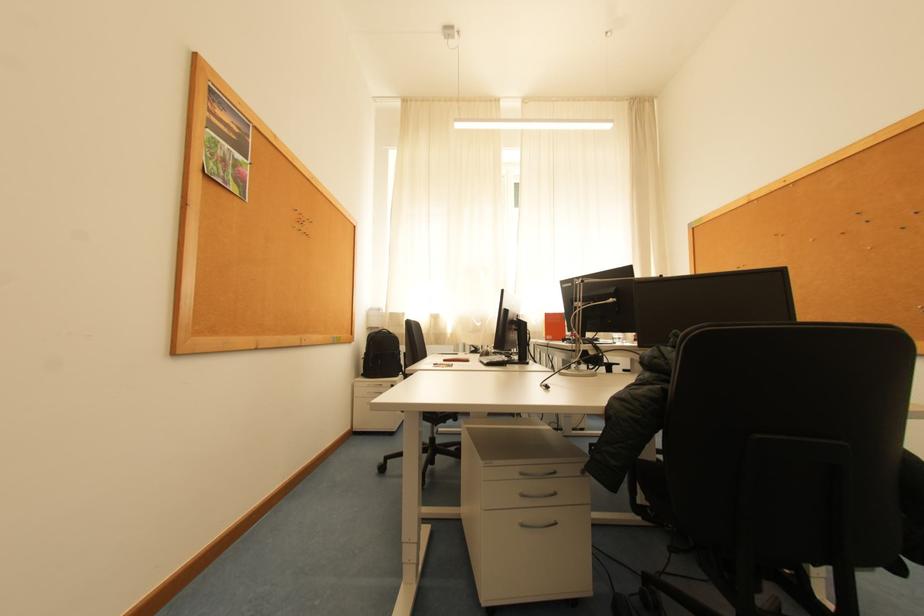
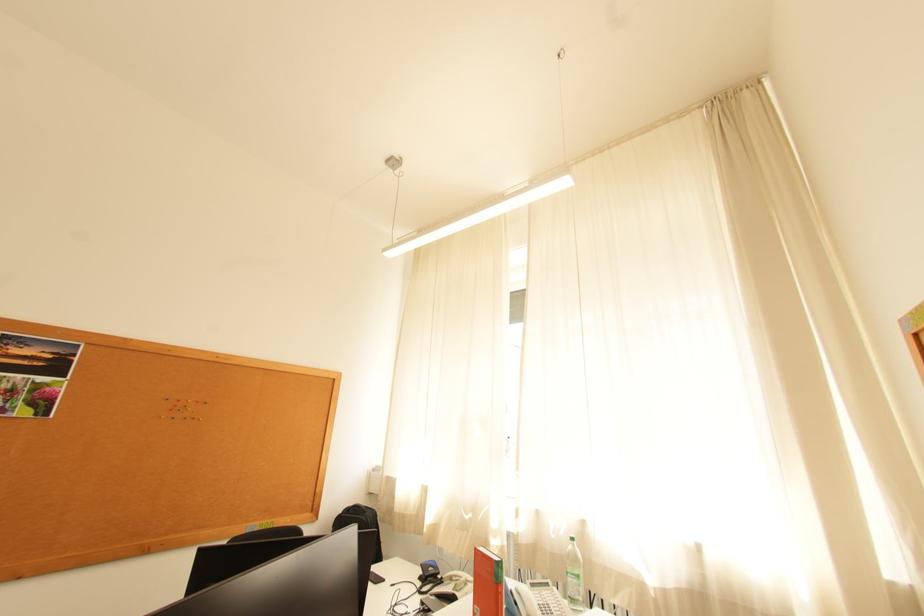
Find the pixel in the second image that matches point 546,323 in the first image.

(569, 536)